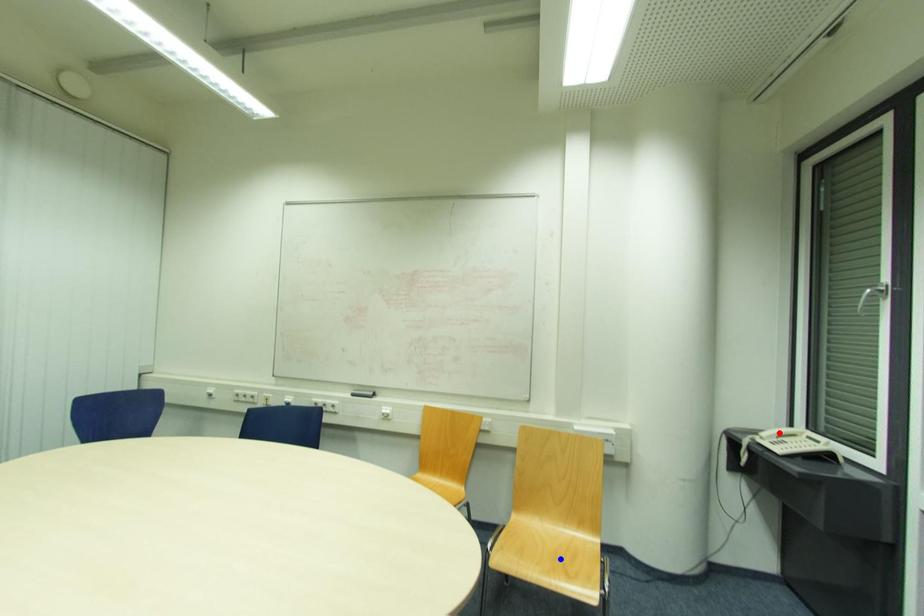
Question: In the image, two points are highlighted. Which point is nearer to the camera? Reply with the corresponding letter.

Choices:
 (A) blue point
 (B) red point

Answer: (A)